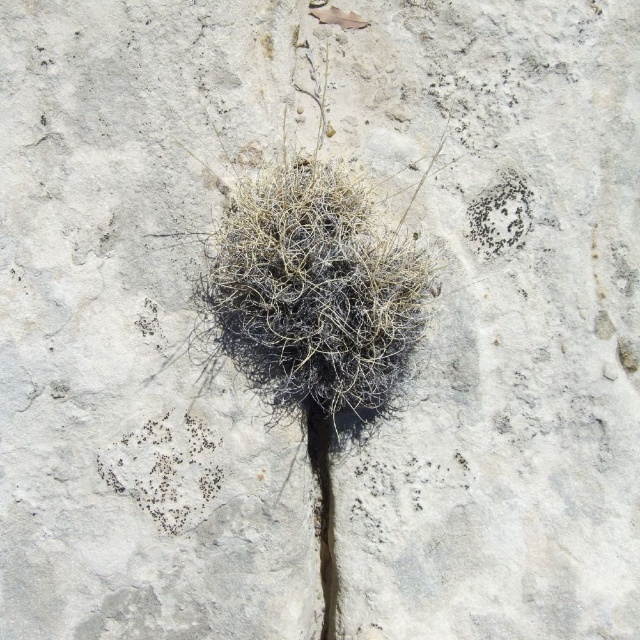
Question: Which object is the closest to the black speckled rock at upper right?

Choices:
 (A) fuzzy black plant at center
 (B) black speckled rock at lower left

Answer: (A)

Question: Which point is farther to the camera?

Choices:
 (A) (172, 502)
 (B) (508, 205)
 (C) (248, 358)

Answer: (B)

Question: Where is black speckled rock at lower left located in relation to black speckled rock at upper right in the image?

Choices:
 (A) below
 (B) above

Answer: (A)

Question: Can you confirm if black speckled rock at lower left is positioned to the left of black speckled rock at upper right?

Choices:
 (A) yes
 (B) no

Answer: (A)

Question: Among these points, which one is farthest from the camera?

Choices:
 (A) (513, 243)
 (B) (296, 230)

Answer: (A)

Question: Where is black speckled rock at lower left located in relation to black speckled rock at upper right in the image?

Choices:
 (A) right
 (B) left

Answer: (B)